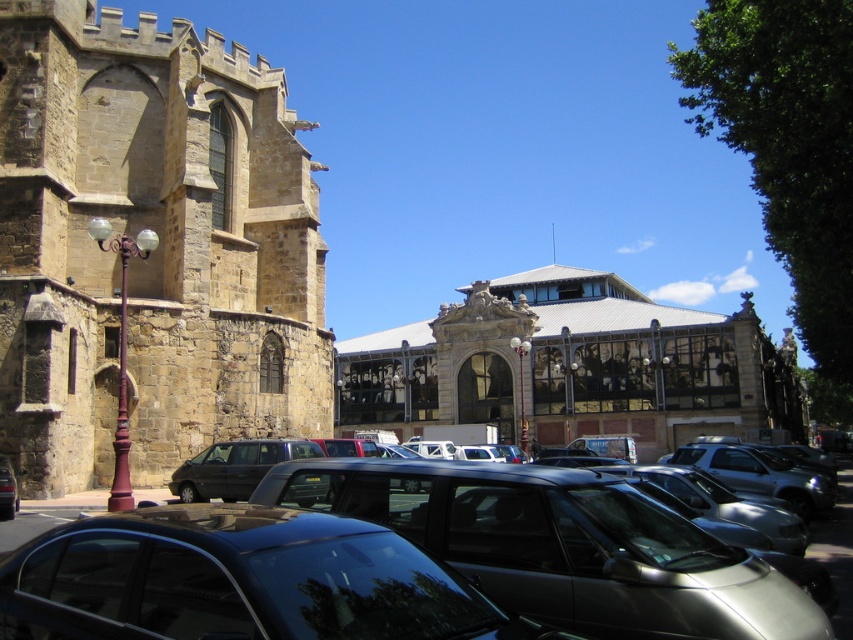
You are a photographer wanting to capture both the brown stone church at left and the glossy black car at lower center in a single frame. Given their height difference, which object will appear larger in the photo?

The brown stone church at left will appear larger in the photo because it has a greater height compared to the glossy black car at lower center.

You are a delivery person who needs to park your vehicle in the parking lot near the historical stone building. You have two options available for parking spaces. The first space is next to the glossy black car at lower center and the second is next to the matte black van at center. Considering the height of the vehicles, which parking space would be more suitable for a standard delivery van that is 2 meters tall?

The matte black van at center is shorter than the glossy black car at lower center. Since the delivery van is 2 meters tall, the parking space next to the matte black van at center would be more suitable as it is likely to have sufficient clearance.